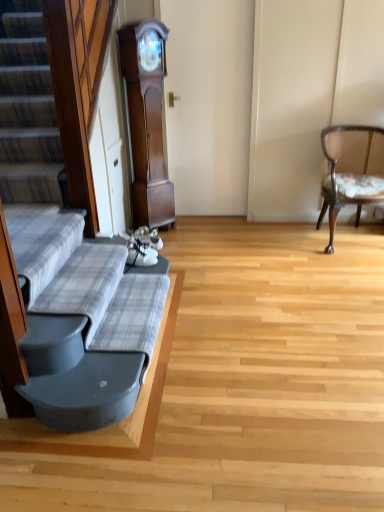
Question: From a real-world perspective, is wooden upholstered chair at right physically above plaid fabric couch at left?

Choices:
 (A) yes
 (B) no

Answer: (A)

Question: Can you confirm if wooden upholstered chair at right is taller than plaid fabric couch at left?

Choices:
 (A) yes
 (B) no

Answer: (A)

Question: Is wooden upholstered chair at right oriented towards plaid fabric couch at left?

Choices:
 (A) no
 (B) yes

Answer: (A)

Question: Does wooden upholstered chair at right have a lesser width compared to plaid fabric couch at left?

Choices:
 (A) no
 (B) yes

Answer: (A)

Question: Is wooden upholstered chair at right facing away from plaid fabric couch at left?

Choices:
 (A) no
 (B) yes

Answer: (A)

Question: Is point (9, 380) closer or farther from the camera than point (332, 180)?

Choices:
 (A) closer
 (B) farther

Answer: (A)

Question: From the image's perspective, is plaid fabric couch at left located above or below wooden upholstered chair at right?

Choices:
 (A) above
 (B) below

Answer: (B)

Question: In terms of width, does plaid fabric couch at left look wider or thinner when compared to wooden upholstered chair at right?

Choices:
 (A) thin
 (B) wide

Answer: (A)

Question: From a real-world perspective, is plaid fabric couch at left physically located above or below wooden upholstered chair at right?

Choices:
 (A) below
 (B) above

Answer: (A)

Question: Does point (377, 196) appear closer or farther from the camera than point (134, 22)?

Choices:
 (A) closer
 (B) farther

Answer: (B)

Question: From the image's perspective, is wooden upholstered chair at right above or below dark wood grandfather clock at center?

Choices:
 (A) above
 (B) below

Answer: (B)

Question: Based on their positions, is wooden upholstered chair at right located to the left or right of dark wood grandfather clock at center?

Choices:
 (A) right
 (B) left

Answer: (A)

Question: In terms of size, does wooden upholstered chair at right appear bigger or smaller than dark wood grandfather clock at center?

Choices:
 (A) small
 (B) big

Answer: (B)

Question: Considering the relative positions of dark wood grandfather clock at center and wooden upholstered chair at right in the image provided, is dark wood grandfather clock at center to the left or to the right of wooden upholstered chair at right?

Choices:
 (A) right
 (B) left

Answer: (B)

Question: From the image's perspective, is dark wood grandfather clock at center located above or below wooden upholstered chair at right?

Choices:
 (A) above
 (B) below

Answer: (A)